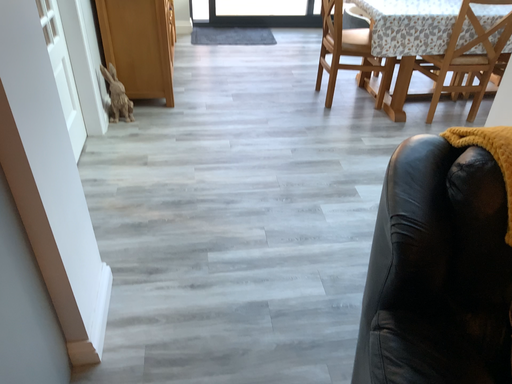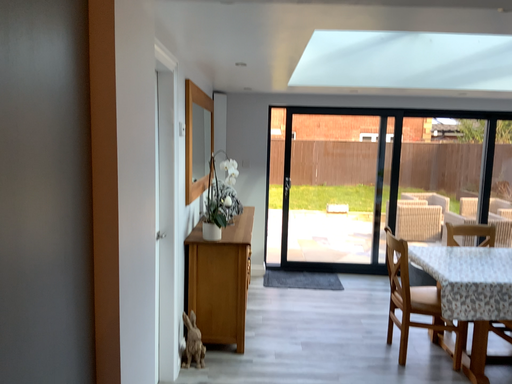
Question: Which way did the camera rotate in the video?

Choices:
 (A) rotated downward
 (B) rotated upward

Answer: (B)